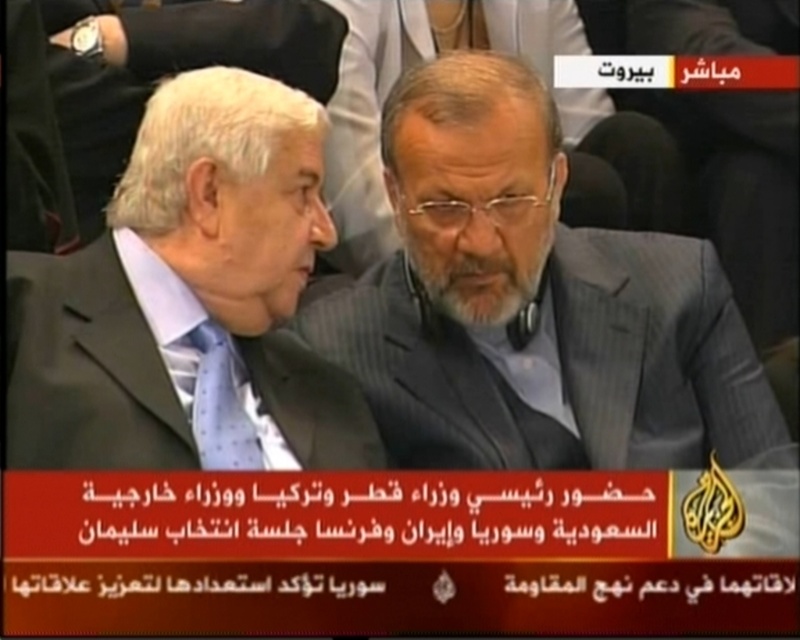
You are a fashion designer analyzing the image of two men in suits. The men are seated in a formal setting. Which of the two suits, the gray textured suit at center or the matte black suit at center, is located lower in the image?

The gray textured suit at center is positioned under the matte black suit at center, so it is located lower in the image.

You are a camera operator filming a news segment. You need to ensure both the gray textured suit at center and the matte black suit at center are visible in the shot. Given their positions, which suit is closer to the camera?

The gray textured suit at center is closer to the camera because the matte black suit at center is positioned behind it.

You are a tailor measuring the distance between two suits in a photo for a client. The client wants to know if there is enough space between the gray textured suit at center and the matte black suit at center to fit a 25 inch wide dress. Can you confirm?

The gray textured suit at center is 24.47 inches from matte black suit at center, so the 25 inch wide dress would not fit between them.